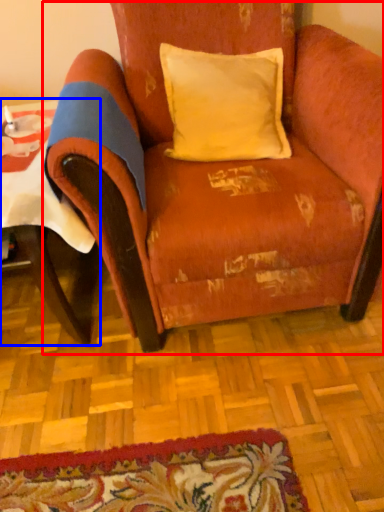
Question: Among these objects, which one is farthest to the camera, chair (highlighted by a red box) or table (highlighted by a blue box)?

Choices:
 (A) chair
 (B) table

Answer: (B)